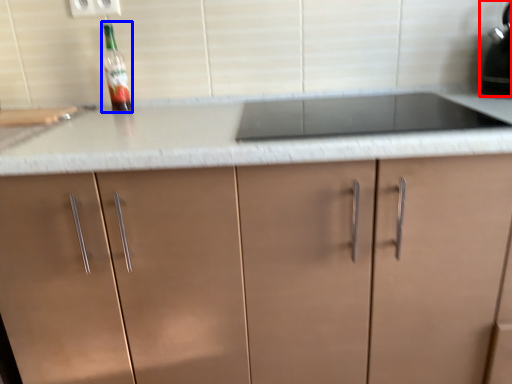
Question: Among these objects, which one is nearest to the camera, kitchen appliance (highlighted by a red box) or bottle (highlighted by a blue box)?

Choices:
 (A) kitchen appliance
 (B) bottle

Answer: (A)